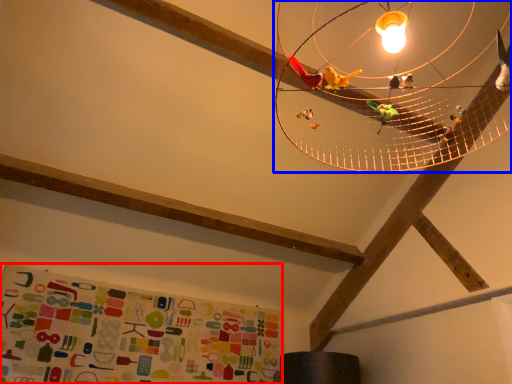
Question: Among these objects, which one is farthest to the camera, bulletin board (highlighted by a red box) or lamp (highlighted by a blue box)?

Choices:
 (A) bulletin board
 (B) lamp

Answer: (A)